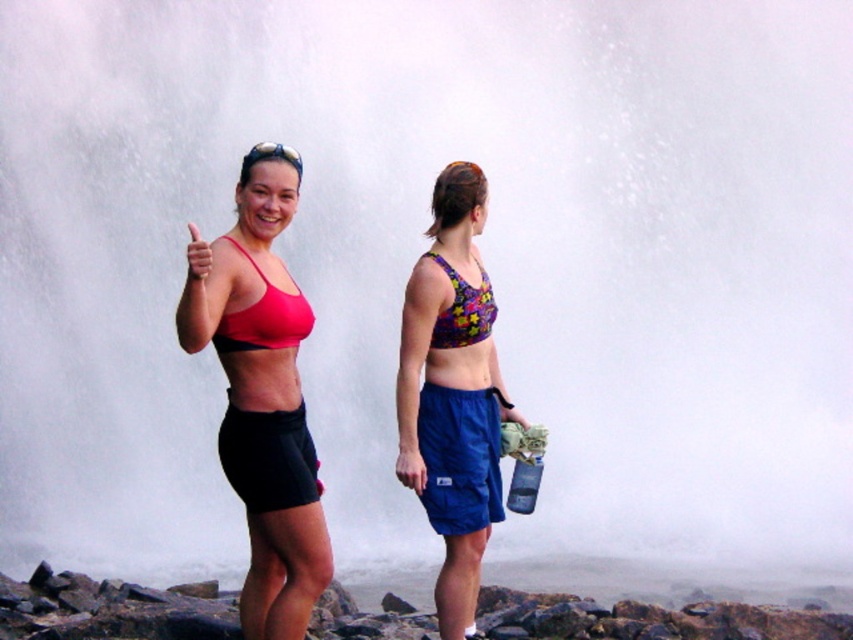
Between black matte shorts at lower center and multicolored fabric bikini top at center, which one is positioned lower?

Positioned lower is black matte shorts at lower center.

Does black matte shorts at lower center appear under multicolored fabric bikini top at center?

Correct, black matte shorts at lower center is located below multicolored fabric bikini top at center.

Is point (259, 429) closer to viewer compared to point (439, 209)?

Yes.

Image resolution: width=853 pixels, height=640 pixels. What are the coordinates of `black matte shorts at lower center` in the screenshot? It's located at (268, 458).

Does matte red sports bra at center have a greater height compared to blue fabric shorts at lower center?

Yes.

Is matte red sports bra at center wider than blue fabric shorts at lower center?

Indeed, matte red sports bra at center has a greater width compared to blue fabric shorts at lower center.

I want to click on matte red sports bra at center, so click(x=264, y=396).

Who is shorter, matte red sports bra at center or floral fabric bikini top at center?

floral fabric bikini top at center

Is point (260, 321) positioned behind point (451, 346)?

No, (260, 321) is in front of (451, 346).

The width and height of the screenshot is (853, 640). I want to click on matte red sports bra at center, so click(x=264, y=396).